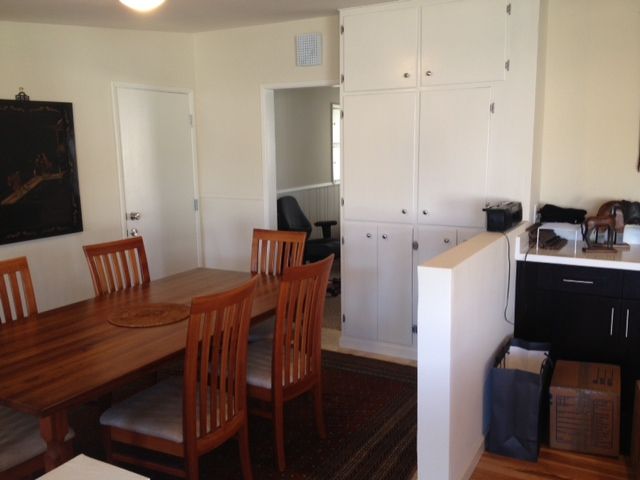
The height and width of the screenshot is (480, 640). What are the coordinates of `white door` in the screenshot? It's located at (180, 201).